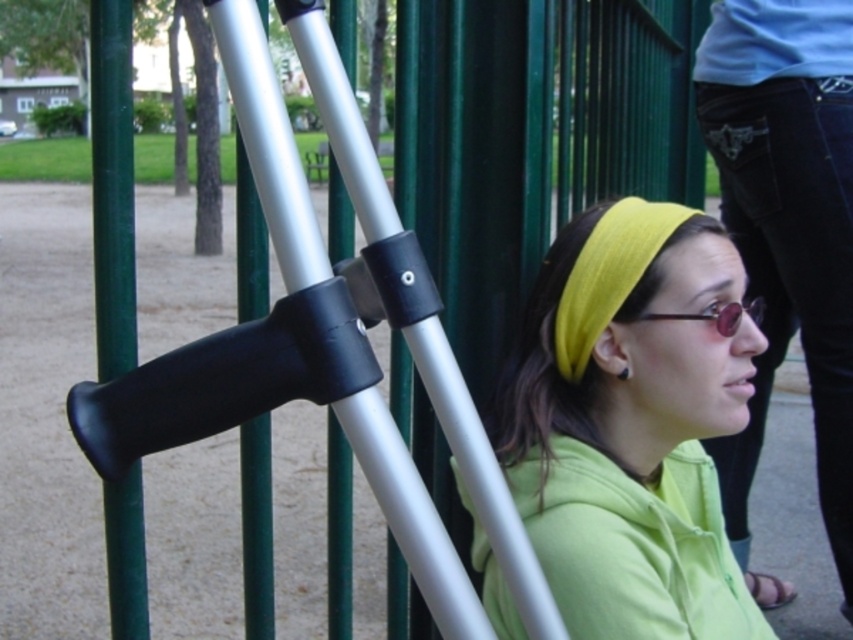
Question: Estimate the real-world distances between objects in this image. Which object is closer to the black rubber crutch at center?

Choices:
 (A) lime green fabric at center
 (B) sunglasses at center

Answer: (A)

Question: Does lime green fabric at center have a larger size compared to sunglasses at center?

Choices:
 (A) no
 (B) yes

Answer: (B)

Question: Among these objects, which one is nearest to the camera?

Choices:
 (A) sunglasses at center
 (B) lime green fabric at center

Answer: (B)

Question: Can you confirm if green matte pole at center-left is bigger than sunglasses at center?

Choices:
 (A) no
 (B) yes

Answer: (B)

Question: Is black rubber crutch at center above sunglasses at center?

Choices:
 (A) no
 (B) yes

Answer: (A)

Question: Which is nearer to the black rubber crutch at center?

Choices:
 (A) sunglasses at center
 (B) green matte pole at center-left
 (C) lime green fabric at center

Answer: (B)